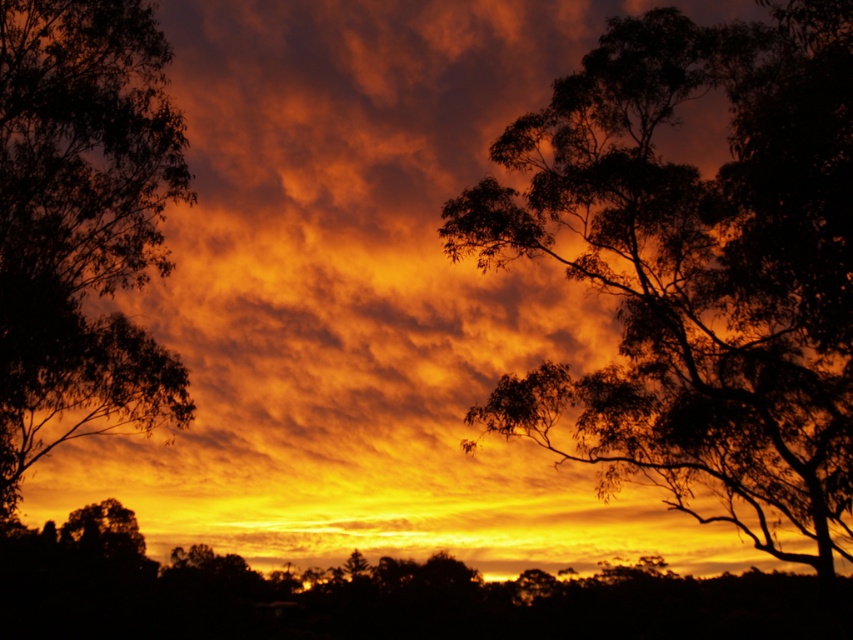
Looking at this image, you are an astronomer analyzing the sunset scene. The dark green leafy tree at center is at point 0.419, 0.818. If you want to place a marker at the exact center of the image, which is at point 0.5, 0.5, will the tree be to the left or right of the marker?

The dark green leafy tree at center is located at point (697, 268). The exact center of the image is at (426, 320). Since 0.419 is less than 0.5 on the x axis, the tree is to the left of the marker.

You are an astronomer observing the sunset scene. You notice two points in the sky, one at point (618, 252) and the other at point (122, 276). Which point is closer to the foreground?

Point (122, 276) is closer to the foreground because it is in front of point (618, 252).

You are an artist trying to paint the sunset scene. You want to ensure the trees are placed correctly in terms of depth. Which tree should you paint first to create the illusion of depth, the dark green leafy tree at center or the silhouette leafy tree at left?

You should paint the silhouette leafy tree at left first because the dark green leafy tree at center is closer to the viewer and will overlap it, creating depth.